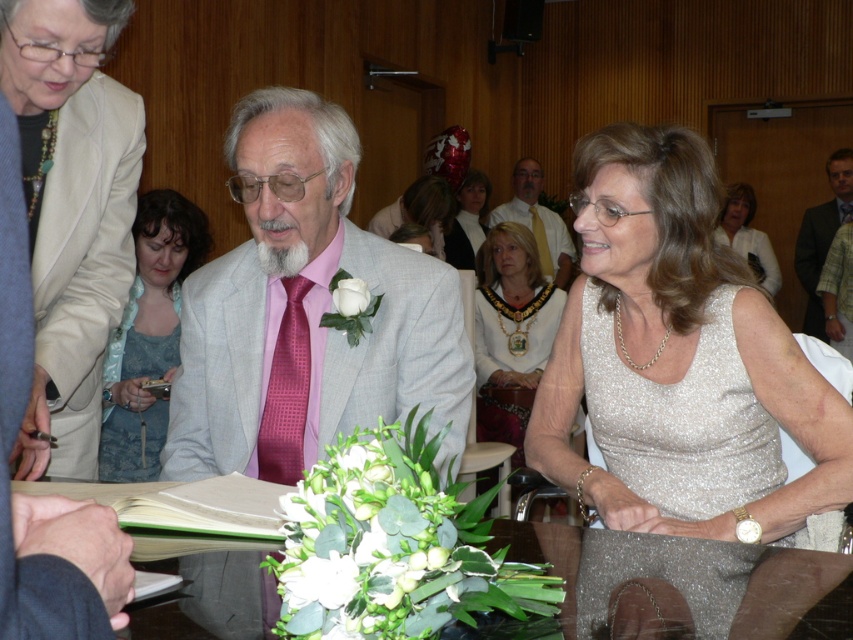
Question: Which object is the closest to the sparkly silver dress at lower right?

Choices:
 (A) matte gold necklace at upper center
 (B) white lace dress at center
 (C) light blue lace dress at lower left

Answer: (C)

Question: Which of the following is the farthest from the observer?

Choices:
 (A) sparkly silver dress at lower right
 (B) light brown checkered shirt at center

Answer: (B)

Question: Is matte gold necklace at upper center positioned at the back of white lace dress at center?

Choices:
 (A) no
 (B) yes

Answer: (A)

Question: Does white satin dress at center appear over matte gold necklace at upper center?

Choices:
 (A) yes
 (B) no

Answer: (B)

Question: Does beige satin jacket at upper left appear over shiny purple tie at center?

Choices:
 (A) yes
 (B) no

Answer: (B)

Question: Based on their relative distances, which object is nearer to the white lace dress at center?

Choices:
 (A) light blue lace dress at lower left
 (B) matte gold necklace at upper center
 (C) matte pink tie at center
 (D) shiny purple tie at center

Answer: (B)